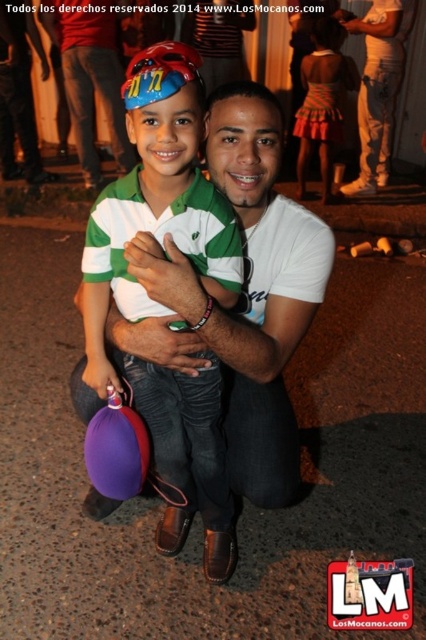
You are standing in the festive outdoor scene and want to walk from the point at coordinates point [146,396] to the point at coordinates point [348,76]. Since you can only move forward, will you be moving towards or away from the viewer as you walk?

Since point [146,396] is closer to the viewer than point [348,76], moving from point [146,396] to point [348,76] means you are moving away from the viewer.

You are at a party and want to take a photo of the green matte shirt at center and the striped fabric dress at upper right. Which one is positioned lower in the frame?

The green matte shirt at center is located below striped fabric dress at upper right, so the green matte shirt at center is positioned lower in the frame.